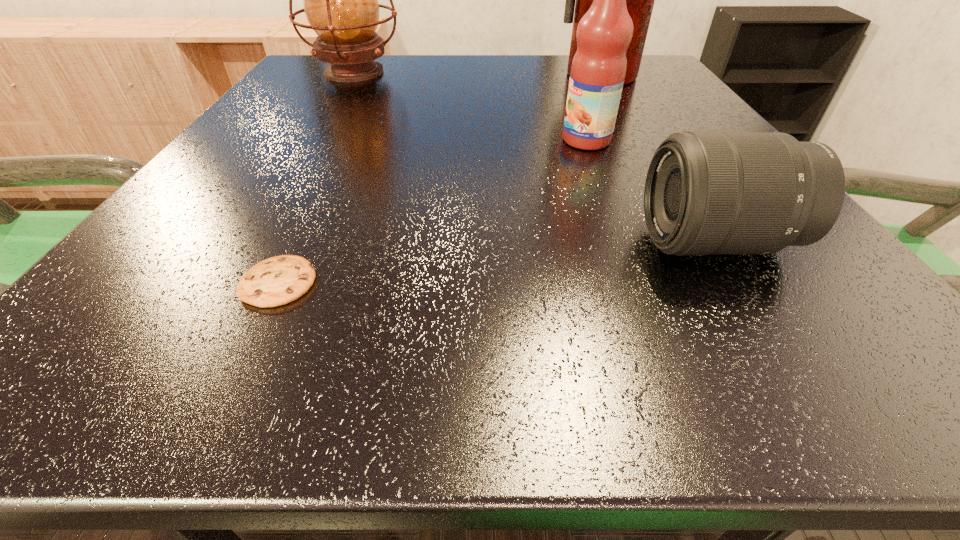
You are a GUI agent. You are given a task and a screenshot of the screen. Output one action in this format:
    pyautogui.click(x=<x>, y=<y>)
    Task: Click on the telephoto lens at the right edge
    This screenshot has width=960, height=540.
    Given the screenshot: What is the action you would take?
    pyautogui.click(x=706, y=192)

Locate an element on the screen. This screenshot has height=540, width=960. object at the far left corner is located at coordinates (340, 0).

Where is `object positioned at the far right corner`? Image resolution: width=960 pixels, height=540 pixels. object positioned at the far right corner is located at coordinates (640, 0).

Image resolution: width=960 pixels, height=540 pixels. I want to click on vacant space at the far edge of the desktop, so click(476, 73).

Identify the location of free space at the near edge. This screenshot has height=540, width=960. (400, 323).

Image resolution: width=960 pixels, height=540 pixels. Identify the location of vacant region at the left edge of the desktop. (170, 293).

This screenshot has height=540, width=960. Identify the location of vacant position at the right edge of the desktop. pos(848,307).

This screenshot has height=540, width=960. Identify the location of unoccupied area between the second tallest object and the fruit juice. (470, 106).

This screenshot has width=960, height=540. I want to click on vacant space that's between the second tallest object and the second shortest object, so click(x=535, y=157).

The height and width of the screenshot is (540, 960). In order to click on free spot between the oil lamp and the cookie in this screenshot , I will do `click(316, 177)`.